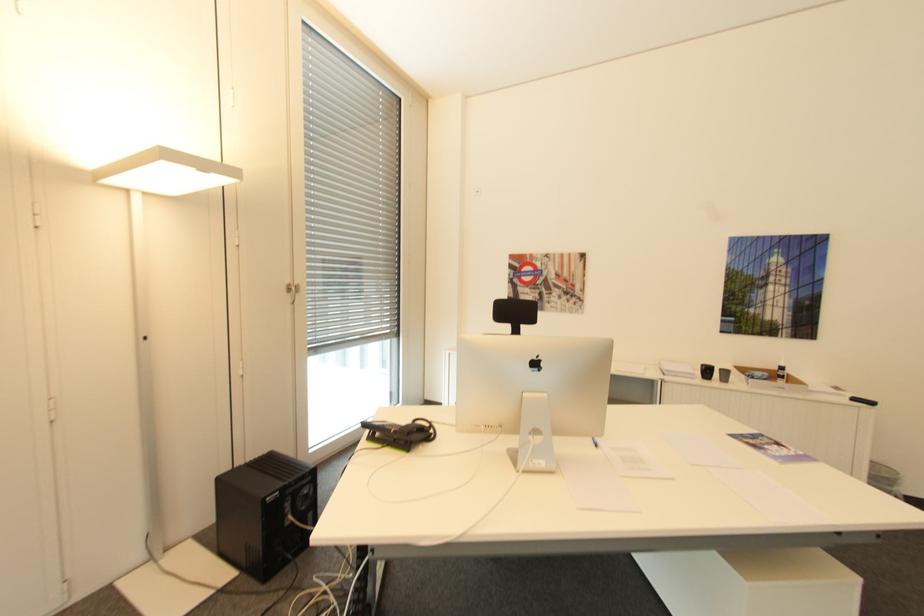
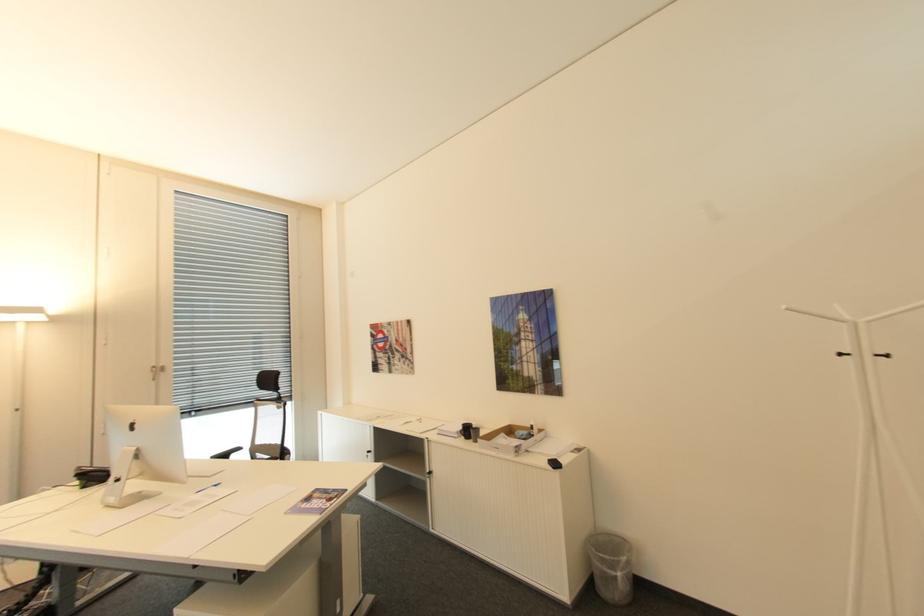
The point at (292,285) is marked in the first image. Where is the corresponding point in the second image?

(159, 367)